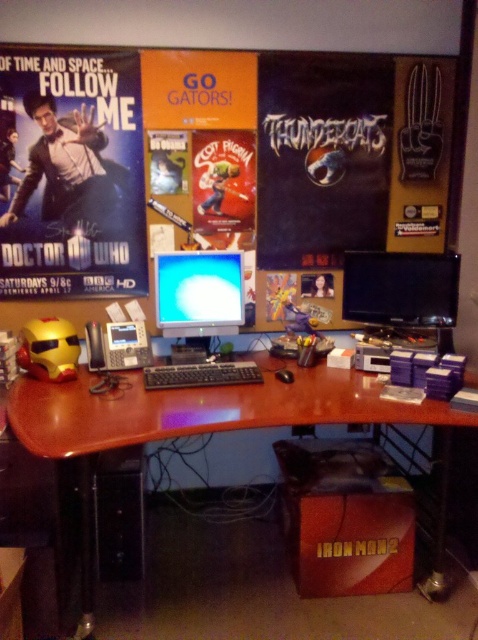
You are organizing your desk and want to place a new item between the wooden bulletin board at upper center and the matte paper poster at upper left. Based on their positions, where should you place the new item?

The wooden bulletin board at upper center is to the right of the matte paper poster at upper left, so you should place the new item between them on the left side of the bulletin board and the right side of the poster.

You are standing in front of the desk and want to place a 2.5 meter long cable between the wooden bulletin board at upper center and the computer monitor. Will the cable be long enough?

The distance between the wooden bulletin board at upper center and the computer monitor is 2.36 meters. The cable is 2.5 meters long, so it will be long enough to reach between them.

You are setting up a new desk lamp and want to place it on the desk. The lamp has a base that requires 10 cm of space. Considering the location of the matte paper poster at upper left, is there enough space to place the lamp there?

The matte paper poster at upper left is located at point (74, 173), which indicates its position on the desk. However, without specific measurements of the desk dimensions or the exact size of the poster, it is unclear if there is sufficient space for the lamp. Please ensure there is at least 10 cm of clear space before placing the lamp.